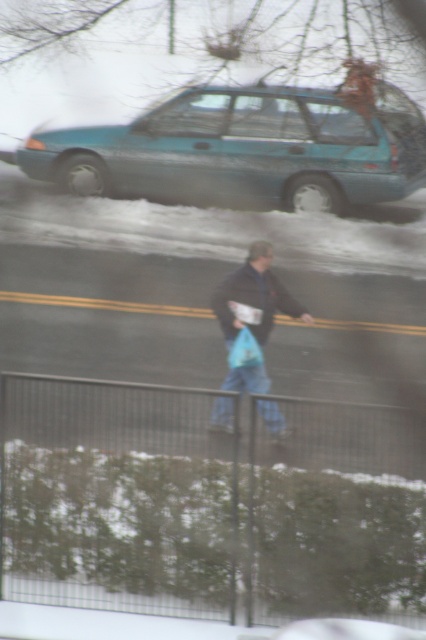
Based on the photo, you are a pedestrian trying to cross the road safely. You see a metallic wire fence at lower center and blue denim jeans at center. Which object is closer to the road?

The metallic wire fence at lower center is positioned on the left side of blue denim jeans at center, so the blue denim jeans at center is closer to the road.